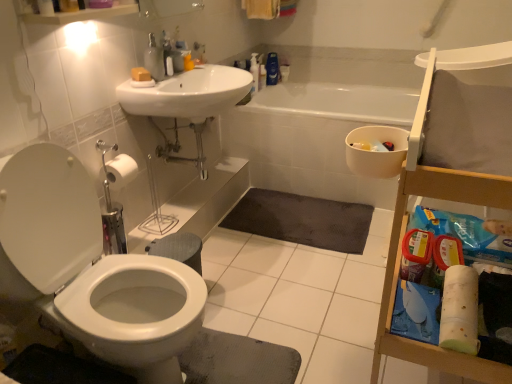
The width and height of the screenshot is (512, 384). Identify the location of vacant area in front of dark gray textured bath mat at center. (296, 277).